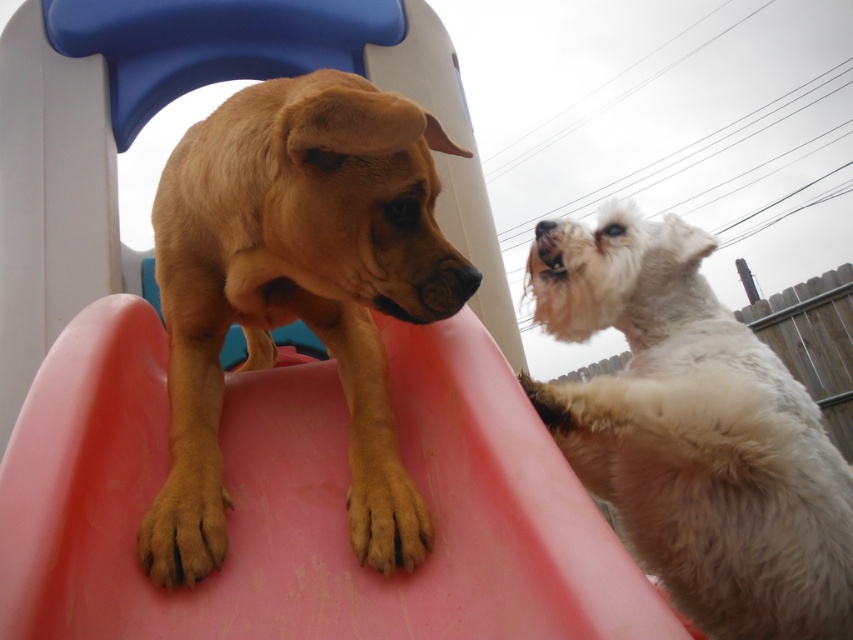
You are a dog owner who wants to ensure both dogs can play safely on the slide. The slide is 3 feet wide. Knowing that the white fluffy dog at upper right and the brown fur paw at lower left are on the slide, can both dogs fit on the slide without overlapping?

The white fluffy dog at upper right is 4.02 feet from the brown fur paw at lower left, which means they are spaced more than the slide width of 3 feet apart. Therefore, they cannot both fit on the slide without overlapping.

You are standing in front of a childrens playset with two dogs. There is a point at coordinates point (479,484). If you want to reach that point, which direction should you move relative to your current position?

The point (479,484) is 5.07 feet away from viewer, so you should move towards it in the direction it is located to reach it.